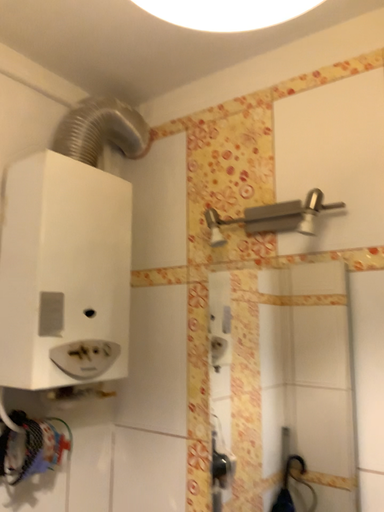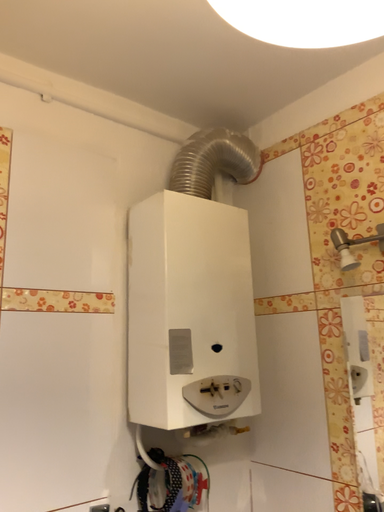
Question: How did the camera likely rotate when shooting the video?

Choices:
 (A) rotated right
 (B) rotated left

Answer: (B)